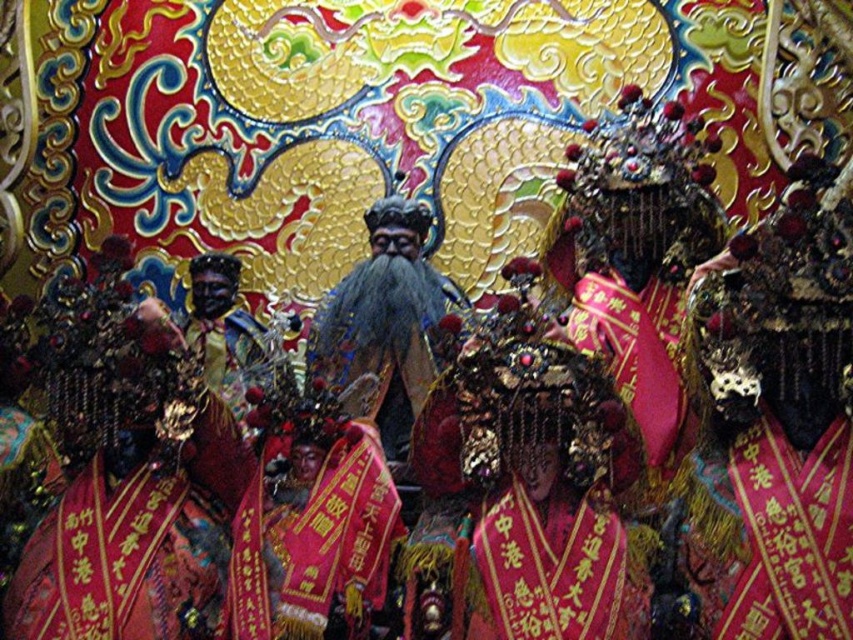
Is velvet red banner at center behind shiny gold statue at center?

That is False.

Between velvet red banner at center and shiny gold statue at center, which one appears on the left side from the viewer's perspective?

shiny gold statue at center

Is point (540, 634) in front of point (410, 218)?

Yes, point (540, 634) is closer to viewer.

The width and height of the screenshot is (853, 640). What are the coordinates of `velvet red banner at center` in the screenshot? It's located at (549, 572).